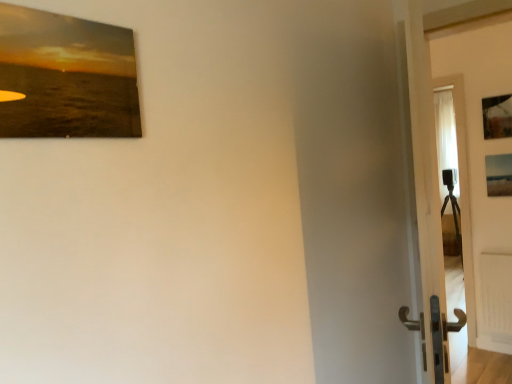
Question: From a real-world perspective, is wooden frame at upper right, which ranks as the 3th picture frame in bottom-to-top order, above or below white matte radiator at lower right?

Choices:
 (A) above
 (B) below

Answer: (A)

Question: Considering the positions of wooden frame at upper right, which appears as the 2th picture frame when viewed from the back, and white matte radiator at lower right in the image, is wooden frame at upper right, which appears as the 2th picture frame when viewed from the back, bigger or smaller than white matte radiator at lower right?

Choices:
 (A) big
 (B) small

Answer: (B)

Question: Estimate the real-world distances between objects in this image. Which object is closer to the white matte radiator at lower right?

Choices:
 (A) matte wooden picture frame at upper left, the 2th picture frame in the top-to-bottom sequence
 (B) wooden frame at upper right, which appears as the 2th picture frame when viewed from the back
 (C) white glossy door at right
 (D) matte wooden picture frame at right, positioned as the third picture frame in front-to-back order

Answer: (D)

Question: Considering the real-world distances, which object is closest to the white matte radiator at lower right?

Choices:
 (A) matte wooden picture frame at upper left, the 2th picture frame in the top-to-bottom sequence
 (B) matte wooden picture frame at right, the 3th picture frame when ordered from top to bottom
 (C) white glossy door at right
 (D) wooden frame at upper right, which is the first picture frame in top-to-bottom order

Answer: (B)